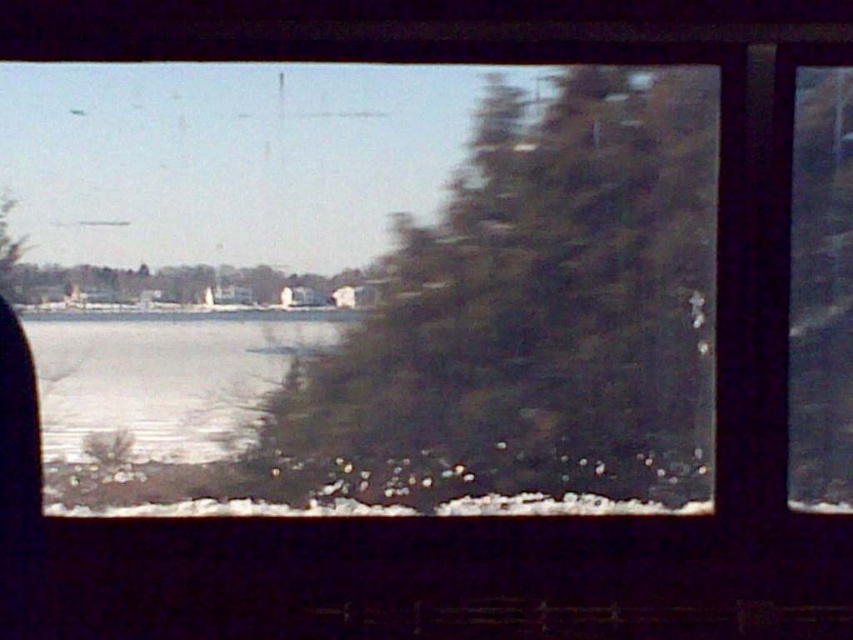
Question: Which of the following is the closest to the observer?

Choices:
 (A) (566, 412)
 (B) (167, 362)

Answer: (B)

Question: Which point is closer to the camera?

Choices:
 (A) clear ice at lower left
 (B) green textured tree at center

Answer: (B)

Question: Can you confirm if green textured tree at center is positioned below clear ice at lower left?

Choices:
 (A) no
 (B) yes

Answer: (A)

Question: Does green textured tree at center lie behind clear ice at lower left?

Choices:
 (A) no
 (B) yes

Answer: (A)

Question: Can you confirm if green textured tree at center is thinner than clear ice at lower left?

Choices:
 (A) yes
 (B) no

Answer: (B)